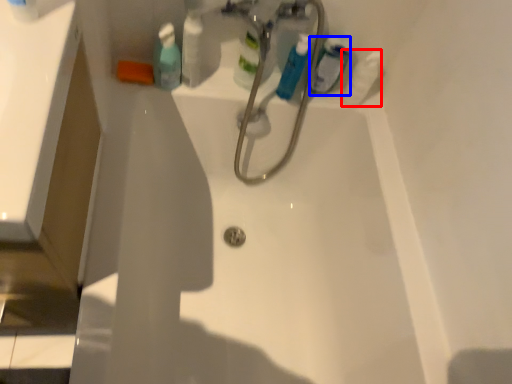
Question: Among these objects, which one is nearest to the camera, cleaning product (highlighted by a red box) or mouthwash (highlighted by a blue box)?

Choices:
 (A) cleaning product
 (B) mouthwash

Answer: (B)